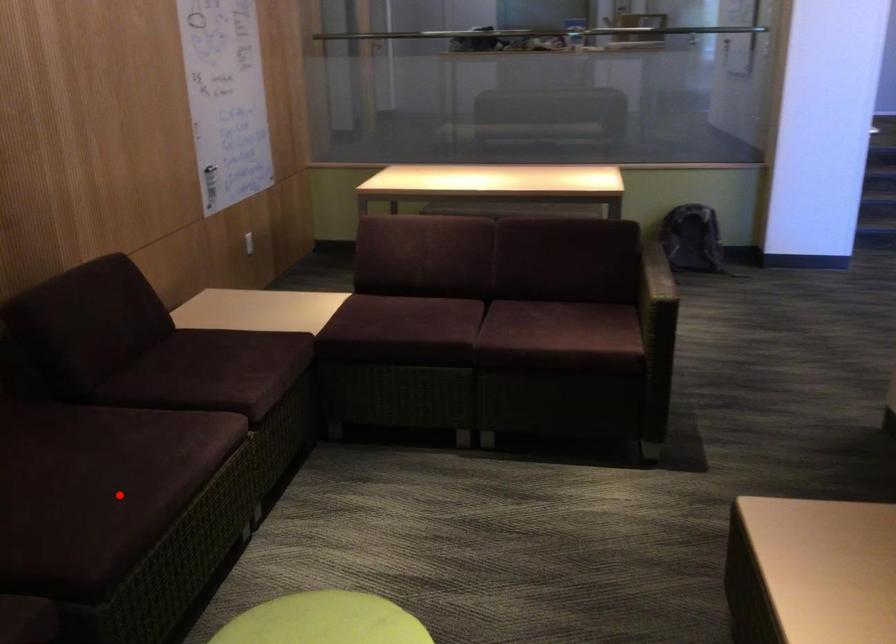
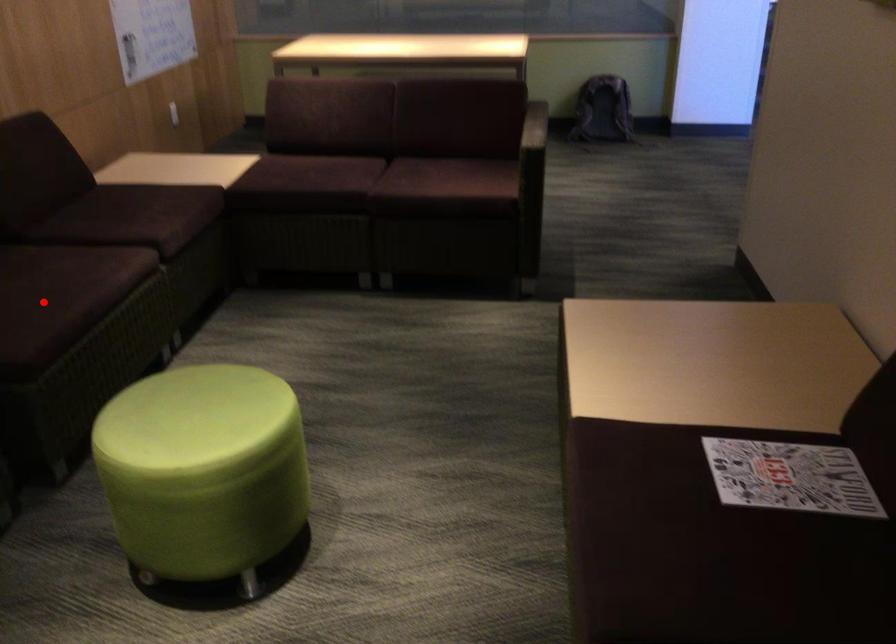
I am providing you with two images of the same scene from different viewpoints. A red point is marked on the first image and another point is marked on the second image. Are the points marked in image1 and image2 representing the same 3D position?

Yes